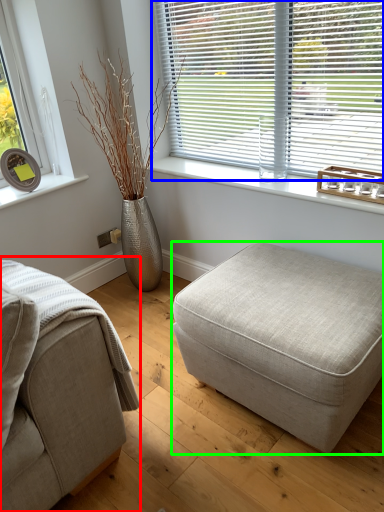
Question: Which object is positioned closest to studio couch (highlighted by a red box)? Select from window blind (highlighted by a blue box) and stool (highlighted by a green box).

Choices:
 (A) window blind
 (B) stool

Answer: (B)